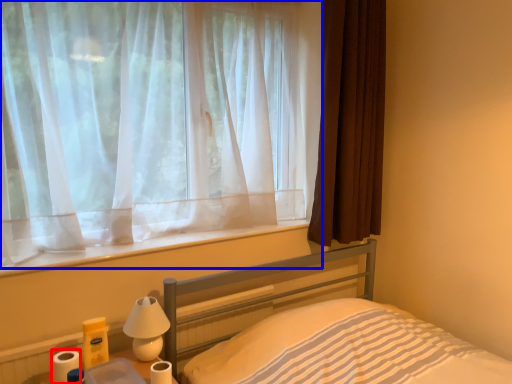
Question: Among these objects, which one is nearest to the camera, toilet paper (highlighted by a red box) or curtain (highlighted by a blue box)?

Choices:
 (A) toilet paper
 (B) curtain

Answer: (B)